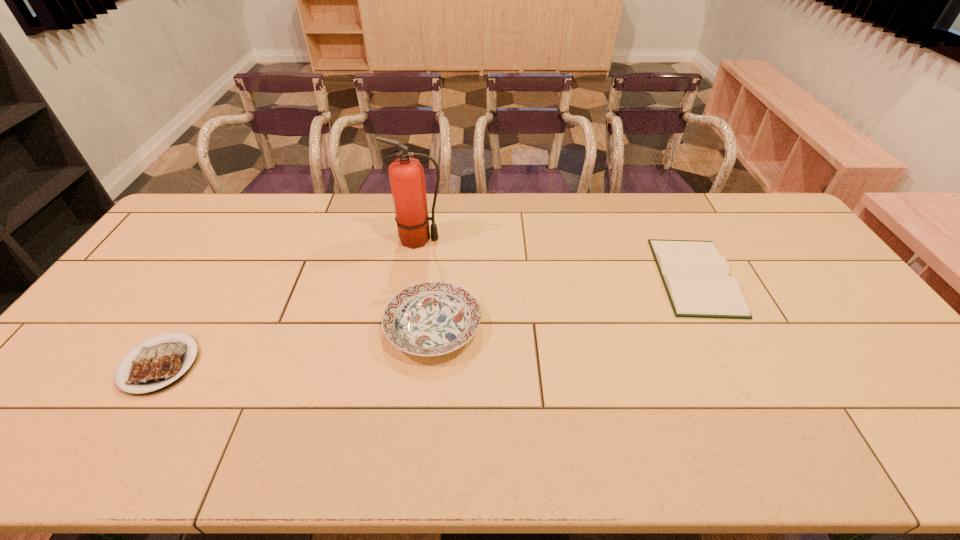
Where is `vacant area that lies between the second tallest object and the left plate`? This screenshot has height=540, width=960. vacant area that lies between the second tallest object and the left plate is located at coordinates (297, 345).

You are a GUI agent. You are given a task and a screenshot of the screen. Output one action in this format:
    pyautogui.click(x=<x>, y=<y>)
    Task: Click on the free space between the hardback book and the tallest object
    
    Given the screenshot: What is the action you would take?
    pyautogui.click(x=557, y=258)

I want to click on unoccupied position between the rightmost object and the fire extinguisher, so click(557, 258).

Locate an element on the screen. blank region between the rightmost object and the tallest object is located at coordinates (557, 258).

Identify the location of vacant space that is in between the tallest object and the hardback book. The height and width of the screenshot is (540, 960). (557, 258).

The width and height of the screenshot is (960, 540). I want to click on the second closest object to the fire extinguisher, so click(157, 365).

Point out which object is positioned as the nearest to the rightmost object. Please provide its 2D coordinates. Your answer should be formatted as a tuple, i.e. [(x, y)], where the tuple contains the x and y coordinates of a point satisfying the conditions above.

[(433, 318)]

Locate an element on the screen. free location that satisfies the following two spatial constraints: 1. on the back side of the rightmost object; 2. on the left side of the taller plate is located at coordinates 438,276.

Locate an element on the screen. This screenshot has height=540, width=960. vacant point that satisfies the following two spatial constraints: 1. on the nozzle of the fire extinguisher; 2. on the front side of the shorter plate is located at coordinates coord(398,364).

Where is `vacant space that satisfies the following two spatial constraints: 1. on the nozzle of the tallest object; 2. on the left side of the hardback book`? This screenshot has height=540, width=960. vacant space that satisfies the following two spatial constraints: 1. on the nozzle of the tallest object; 2. on the left side of the hardback book is located at coordinates (413, 276).